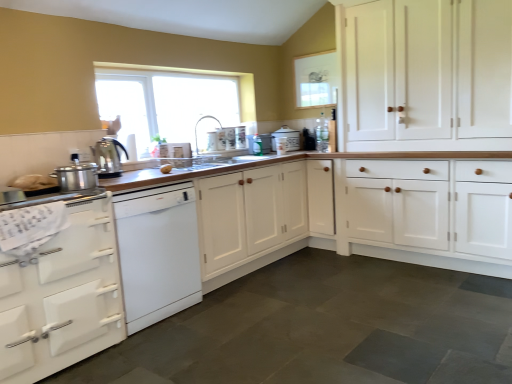
Question: From the image's perspective, relative to yellow matte potato at center, is white matte oven at lower left, arranged as the third cabinetry when viewed from the right, above or below?

Choices:
 (A) below
 (B) above

Answer: (A)

Question: Is white matte oven at lower left, which appears as the first cabinetry when viewed from the left, situated inside yellow matte potato at center or outside?

Choices:
 (A) outside
 (B) inside

Answer: (A)

Question: Based on their relative distances, which object is farther from the white wood cabinet at right, marked as the 1th cabinetry in a right-to-left arrangement?

Choices:
 (A) slate gray stone countertop at lower left
 (B) white ceramic bread bin at center, the fourth appliance positioned from the front
 (C) white matte cabinet at center, placed as the 2th cabinetry when sorted from left to right
 (D) satin nickel faucet at center
 (E) white glossy dishwasher at left

Answer: (E)

Question: Estimate the real-world distances between objects in this image. Which object is closer to the white glossy oven at left, the fourth appliance in the right-to-left sequence?

Choices:
 (A) white matte cabinet at center, placed as the 2th cabinetry when sorted from left to right
 (B) white plastic toaster at upper center, arranged as the 2th appliance when ordered from the bottom
 (C) white matte oven at lower left, arranged as the third cabinetry when viewed from the right
 (D) satin silver kettle at center, which is the 2th kitchen appliance in front-to-back order
 (E) white wood cabinet at right, marked as the 1th cabinetry in a right-to-left arrangement

Answer: (C)